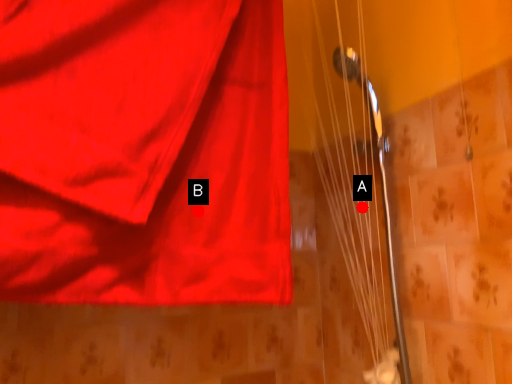
Question: Two points are circled on the image, labeled by A and B beside each circle. Which point is further to the camera?

Choices:
 (A) A is further
 (B) B is further

Answer: (A)